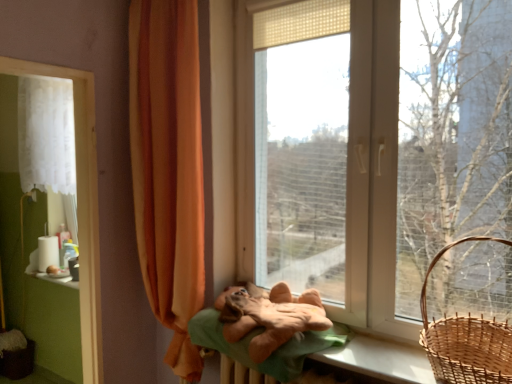
Question: From the image's perspective, is white sheer curtain at left, the first curtain from the left, above soft brown plush at center?

Choices:
 (A) yes
 (B) no

Answer: (A)

Question: Could you tell me if white sheer curtain at left, the first curtain from the left, is facing soft brown plush at center?

Choices:
 (A) yes
 (B) no

Answer: (B)

Question: Is white sheer curtain at left, which ranks as the second curtain in front-to-back order, facing away from soft brown plush at center?

Choices:
 (A) yes
 (B) no

Answer: (B)

Question: Is white sheer curtain at left, which ranks as the second curtain in front-to-back order, bigger than soft brown plush at center?

Choices:
 (A) yes
 (B) no

Answer: (A)

Question: From the image's perspective, is orange fabric curtain at left, the 2th curtain from the back, positioned above or below brown woven basket at lower left?

Choices:
 (A) above
 (B) below

Answer: (A)

Question: Is orange fabric curtain at left, the 1th curtain from the right, taller or shorter than brown woven basket at lower left?

Choices:
 (A) tall
 (B) short

Answer: (A)

Question: From a real-world perspective, is orange fabric curtain at left, the 2th curtain from the back, physically located above or below brown woven basket at lower left?

Choices:
 (A) above
 (B) below

Answer: (A)

Question: Is orange fabric curtain at left, the 1th curtain from the right, spatially inside brown woven basket at lower left, or outside of it?

Choices:
 (A) inside
 (B) outside

Answer: (B)

Question: Visually, is transparent plastic window at center positioned to the left or to the right of white fabric at left?

Choices:
 (A) right
 (B) left

Answer: (A)

Question: Based on their sizes in the image, would you say transparent plastic window at center is bigger or smaller than white fabric at left?

Choices:
 (A) big
 (B) small

Answer: (A)

Question: From the image's perspective, is transparent plastic window at center above or below white fabric at left?

Choices:
 (A) below
 (B) above

Answer: (B)

Question: Relative to white fabric at left, is transparent plastic window at center in front or behind?

Choices:
 (A) behind
 (B) front

Answer: (B)

Question: Considering the relative positions of orange fabric curtain at left, which is counted as the first curtain, starting from the front, and white fabric at left in the image provided, is orange fabric curtain at left, which is counted as the first curtain, starting from the front, to the left or to the right of white fabric at left?

Choices:
 (A) left
 (B) right

Answer: (B)

Question: Considering the positions of point (198, 241) and point (87, 233), is point (198, 241) closer or farther from the camera than point (87, 233)?

Choices:
 (A) farther
 (B) closer

Answer: (B)